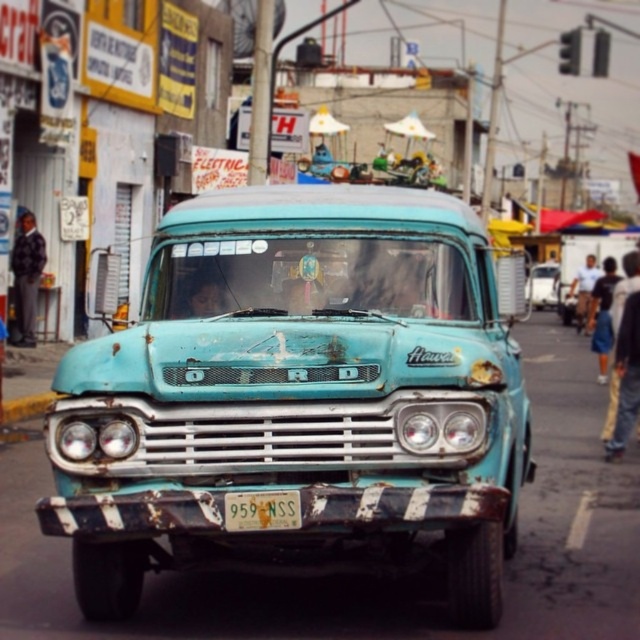
You are standing at the point with coordinates point (228, 493) and want to move to the point with coordinates point (333, 244). Given that you can only move forward in a straight line, will you be able to reach your destination without changing direction?

Since point (333, 244) is behind point (228, 493), moving forward in a straight line from point (228, 493) will not allow you to reach point (333, 244) without changing direction.

You are a pedestrian standing on the sidewalk and see the rusty teal pickup truck at center and the yellow matte license plate at center. Which object is closer to you?

The rusty teal pickup truck at center is closer to you because it is in front of the yellow matte license plate at center.